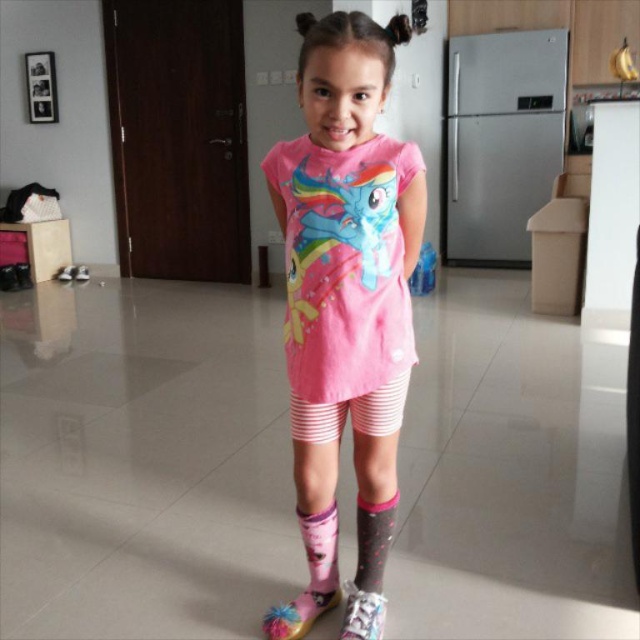
Question: In this image, where is patterned fabric sock at lower center located relative to pink fabric boot at lower center?

Choices:
 (A) below
 (B) above

Answer: (B)

Question: Does pink fabric dress at center appear on the left side of pink fabric boot at lower center?

Choices:
 (A) yes
 (B) no

Answer: (A)

Question: Which of the following is the farthest from the observer?

Choices:
 (A) (321, 250)
 (B) (369, 545)
 (C) (333, 573)

Answer: (C)

Question: Observing the image, what is the correct spatial positioning of pink fabric dress at center in reference to patterned fabric sock at lower center?

Choices:
 (A) right
 (B) left

Answer: (B)

Question: Estimate the real-world distances between objects in this image. Which object is closer to the pink cotton t-shirt at center?

Choices:
 (A) pink fabric boot at lower center
 (B) patterned fabric sock at lower center
 (C) pink fabric dress at center

Answer: (C)

Question: Which of the following is the closest to the observer?

Choices:
 (A) pink fabric dress at center
 (B) pink fabric boot at lower center

Answer: (A)